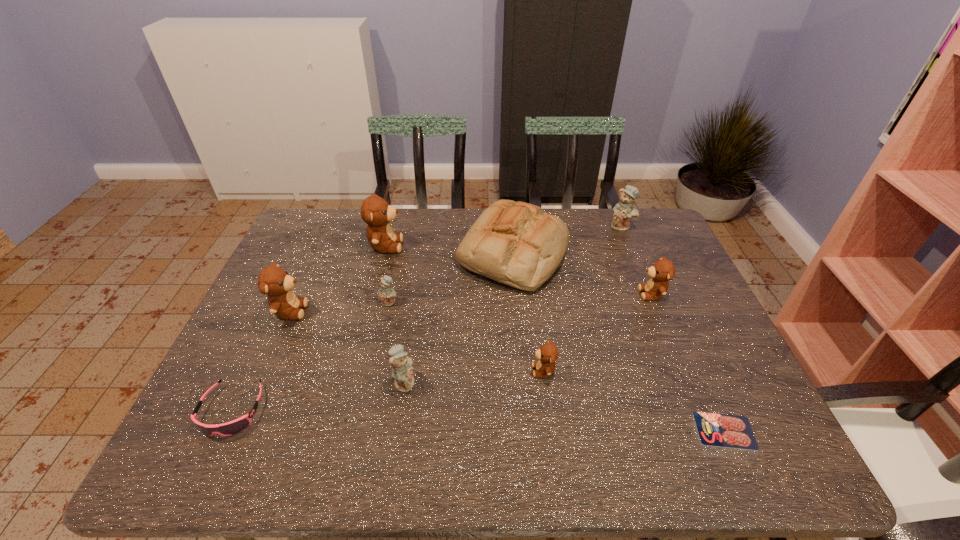
You are a GUI agent. You are given a task and a screenshot of the screen. Output one action in this format:
    pyautogui.click(x=<x>, y=<y>)
    Task: Click on the blue teddy bear that is the closest to the fourth teddy bear from left to right
    Image resolution: width=960 pixels, height=540 pixels.
    Given the screenshot: What is the action you would take?
    pyautogui.click(x=386, y=295)

Identify the location of free region that satisfies the following two spatial constraints: 1. on the front-facing side of the farthest teddy bear; 2. on the face of the biggest brown teddy bear. (630, 246).

Identify the location of vacant area that satisfies the following two spatial constraints: 1. on the front-facing side of the shortest object; 2. on the right side of the leftmost blue teddy bear. The width and height of the screenshot is (960, 540). (362, 430).

What are the coordinates of `vacant area that satisfies the following two spatial constraints: 1. on the face of the second farthest teddy bear; 2. on the right side of the salami` in the screenshot? It's located at (338, 430).

Image resolution: width=960 pixels, height=540 pixels. I want to click on vacant region that satisfies the following two spatial constraints: 1. on the face of the smallest brown teddy bear; 2. on the front-facing side of the goggles, so click(549, 410).

Image resolution: width=960 pixels, height=540 pixels. I want to click on vacant area that satisfies the following two spatial constraints: 1. on the face of the nearest brown teddy bear; 2. on the front-facing side of the pink goggles, so click(549, 410).